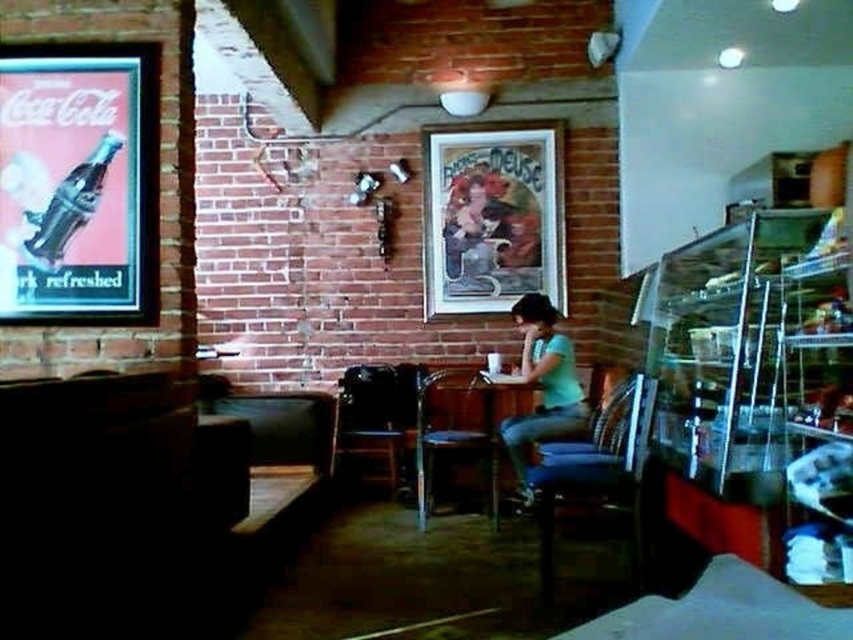
Does point (550, 406) come closer to viewer compared to point (422, 470)?

No, (550, 406) is behind (422, 470).

Is green matte shirt at center bigger than wooden table at center?

Yes.

Is point (524, 308) positioned in front of point (479, 385)?

That is False.

At what (x,y) coordinates should I click in order to perform the action: click on green matte shirt at center. Please return your answer as a coordinate pair (x, y). The height and width of the screenshot is (640, 853). Looking at the image, I should click on (543, 385).

Image resolution: width=853 pixels, height=640 pixels. In order to click on metallic dark chair at center in this screenshot , I will do `click(376, 412)`.

Is metallic dark chair at center above metallic dark blue chair at center?

No.

Which is in front, point (381, 413) or point (457, 385)?

Point (457, 385) is more forward.

Where is `metallic dark chair at center`? This screenshot has height=640, width=853. metallic dark chair at center is located at coordinates (376, 412).

From the picture: Is metallic dark chair at center closer to the viewer compared to matte black cat at center?

That is True.

Who is more forward, (384,385) or (485,236)?

Point (384,385) is more forward.

Where is `metallic dark chair at center`? metallic dark chair at center is located at coordinates (376, 412).